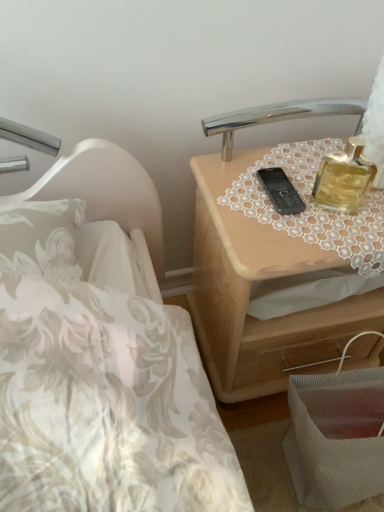
What do you see at coordinates (344, 177) in the screenshot?
I see `gold glass perfume at upper right` at bounding box center [344, 177].

Locate an element on the screen. The image size is (384, 512). gold glass perfume at upper right is located at coordinates (344, 177).

The image size is (384, 512). Find the location of `lace fabric at upper right`. lace fabric at upper right is located at coordinates (314, 207).

Is gold glass perfume at upper right turned away from light wood nightstand at upper right?

No, gold glass perfume at upper right is not facing the opposite direction of light wood nightstand at upper right.

Which is nearer, (358, 194) or (261, 243)?

Point (358, 194) is farther from the camera than point (261, 243).

From the picture: Is gold glass perfume at upper right positioned far away from light wood nightstand at upper right?

No, there isn't a large distance between gold glass perfume at upper right and light wood nightstand at upper right.

In terms of width, does gold glass perfume at upper right look wider or thinner when compared to light wood nightstand at upper right?

gold glass perfume at upper right is thinner than light wood nightstand at upper right.

Is gold glass perfume at upper right bigger or smaller than lace fabric at upper right?

In the image, gold glass perfume at upper right appears to be smaller than lace fabric at upper right.

Identify the location of tablecloth below the gold glass perfume at upper right (from the image's perspective). click(x=314, y=207).

Is gold glass perfume at upper right in contact with lace fabric at upper right?

Indeed, gold glass perfume at upper right and lace fabric at upper right are beside each other and touching.

Which object is wider, light wood nightstand at upper right or lace fabric at upper right?

light wood nightstand at upper right is wider.

Is light wood nightstand at upper right facing away from lace fabric at upper right?

No, light wood nightstand at upper right is not facing the opposite direction of lace fabric at upper right.

Does light wood nightstand at upper right lie behind lace fabric at upper right?

Yes, the depth of light wood nightstand at upper right is greater than that of lace fabric at upper right.

Does point (235, 368) appear closer or farther from the camera than point (317, 187)?

Point (235, 368) appears to be farther away from the viewer than point (317, 187).

From the image's perspective, would you say light wood nightstand at upper right is positioned over gold glass perfume at upper right?

No, from the image's perspective, light wood nightstand at upper right is not above gold glass perfume at upper right.

Could you tell me if lace fabric at upper right is facing light wood nightstand at upper right?

Yes, lace fabric at upper right faces towards light wood nightstand at upper right.

Is lace fabric at upper right bigger or smaller than light wood nightstand at upper right?

Clearly, lace fabric at upper right is smaller in size than light wood nightstand at upper right.

Which is nearer, (381, 203) or (221, 320)?

Point (381, 203) appears to be closer to the viewer than point (221, 320).

Between lace fabric at upper right and light wood nightstand at upper right, which one has more height?

light wood nightstand at upper right is taller.

From a real-world perspective, is lace fabric at upper right physically located above or below gold glass perfume at upper right?

Clearly, from a real-world perspective, lace fabric at upper right is below gold glass perfume at upper right.

Is lace fabric at upper right not inside gold glass perfume at upper right?

lace fabric at upper right is positioned outside gold glass perfume at upper right.

From the image's perspective, is lace fabric at upper right over gold glass perfume at upper right?

Incorrect, from the image's perspective, lace fabric at upper right is lower than gold glass perfume at upper right.

Locate an element on the screen. perfume on the right of light wood nightstand at upper right is located at coordinates (344, 177).

You are a GUI agent. You are given a task and a screenshot of the screen. Output one action in this format:
    pyautogui.click(x=<x>, y=<y>)
    Task: Click on the tablecloth below the gold glass perfume at upper right (from the image's perspective)
    The width and height of the screenshot is (384, 512).
    Given the screenshot: What is the action you would take?
    pyautogui.click(x=314, y=207)

Which object lies further to the anchor point light wood nightstand at upper right, lace fabric at upper right or gold glass perfume at upper right?

Among the two, gold glass perfume at upper right is located further to light wood nightstand at upper right.

Which object lies further to the anchor point lace fabric at upper right, light wood nightstand at upper right or gold glass perfume at upper right?

light wood nightstand at upper right lies further to lace fabric at upper right than the other object.

Looking at this image, looking at the image, which one is located further to gold glass perfume at upper right, lace fabric at upper right or light wood nightstand at upper right?

The object further to gold glass perfume at upper right is light wood nightstand at upper right.

Estimate the real-world distances between objects in this image. Which object is closer to light wood nightstand at upper right, gold glass perfume at upper right or lace fabric at upper right?

lace fabric at upper right is positioned closer to the anchor light wood nightstand at upper right.

Which object lies further to the anchor point lace fabric at upper right, gold glass perfume at upper right or light wood nightstand at upper right?

The object further to lace fabric at upper right is light wood nightstand at upper right.

Looking at the image, which one is located closer to gold glass perfume at upper right, light wood nightstand at upper right or lace fabric at upper right?

Among the two, lace fabric at upper right is located nearer to gold glass perfume at upper right.

Where is `tablecloth between gold glass perfume at upper right and light wood nightstand at upper right in the vertical direction`? tablecloth between gold glass perfume at upper right and light wood nightstand at upper right in the vertical direction is located at coordinates (314, 207).